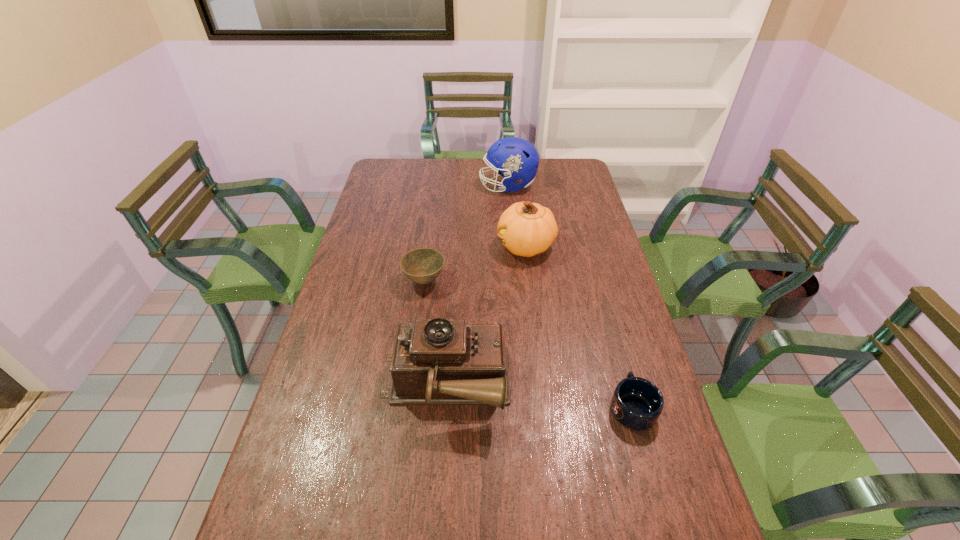
Locate an element on the screen. free space in the image that satisfies the following two spatial constraints: 1. with the handle on the side of the mug; 2. on the face guard of the football helmet is located at coordinates (570, 186).

This screenshot has width=960, height=540. Find the location of `vacant space that satisfies the following two spatial constraints: 1. on the front face of the second farthest object; 2. with the handle on the side of the shortest object`. vacant space that satisfies the following two spatial constraints: 1. on the front face of the second farthest object; 2. with the handle on the side of the shortest object is located at coordinates coord(545,407).